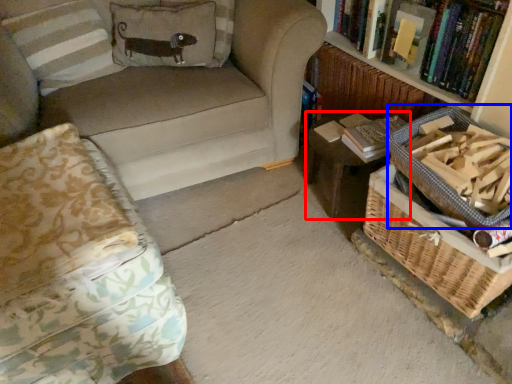
Question: Which point is further to the camera, table (highlighted by a red box) or basket (highlighted by a blue box)?

Choices:
 (A) table
 (B) basket

Answer: (A)